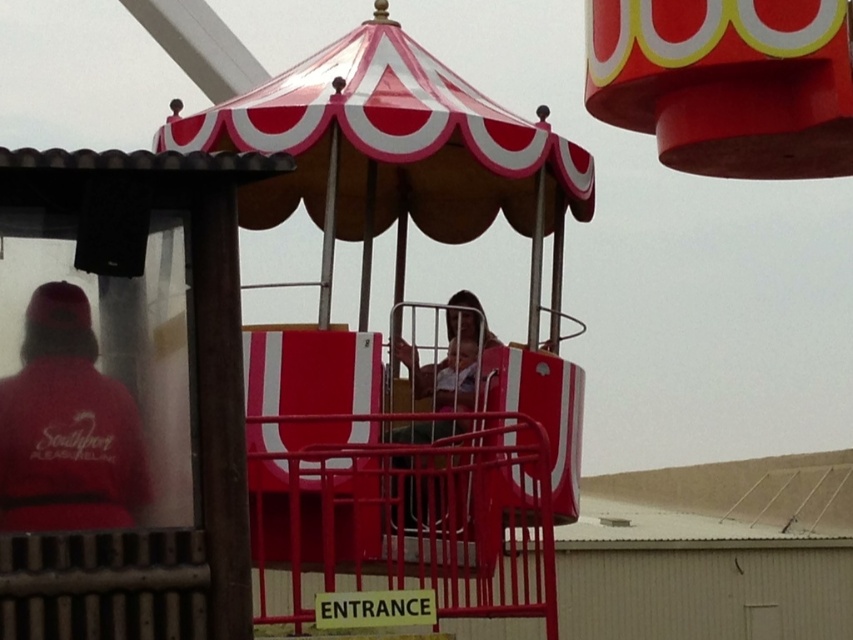
From the picture: Does matte red cap at left lie in front of matte plastic helmet at center?

Yes.

Does point (36, 483) come closer to viewer compared to point (413, 376)?

Yes, point (36, 483) is closer to viewer.

Identify the location of matte red cap at left. (67, 428).